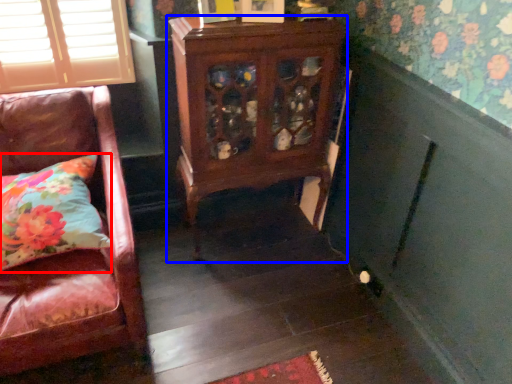
Question: Which object is further to the camera taking this photo, pillow (highlighted by a red box) or furniture (highlighted by a blue box)?

Choices:
 (A) pillow
 (B) furniture

Answer: (B)